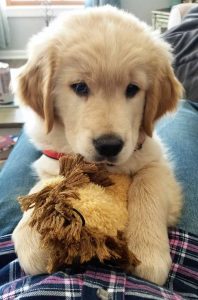
Locate an element on the screen. The image size is (198, 300). light brown table is located at coordinates (12, 116).